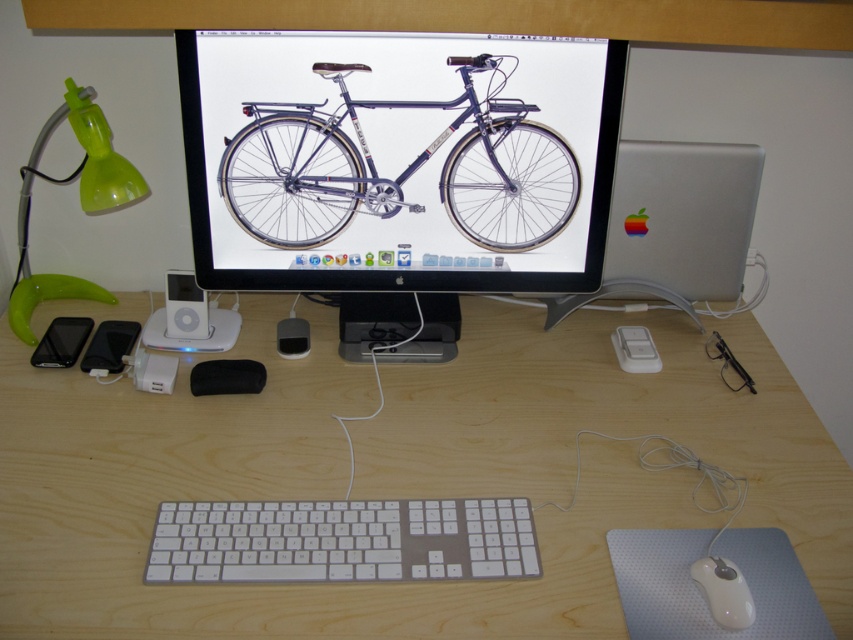
You are a delivery person who needs to place a small package between the green translucent lamp at left and the matte black phone at lower left. The package is 15 centimeters long. Will it fit in the space between them?

The distance between the green translucent lamp at left and the matte black phone at lower left is 15.85 centimeters. Since the package is 15 centimeters long, it will fit with a small amount of space remaining.